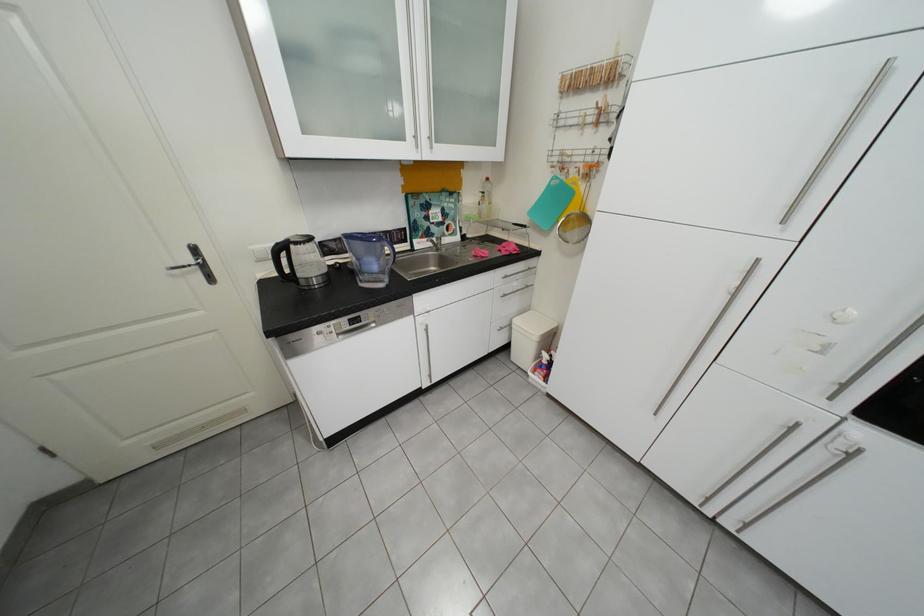
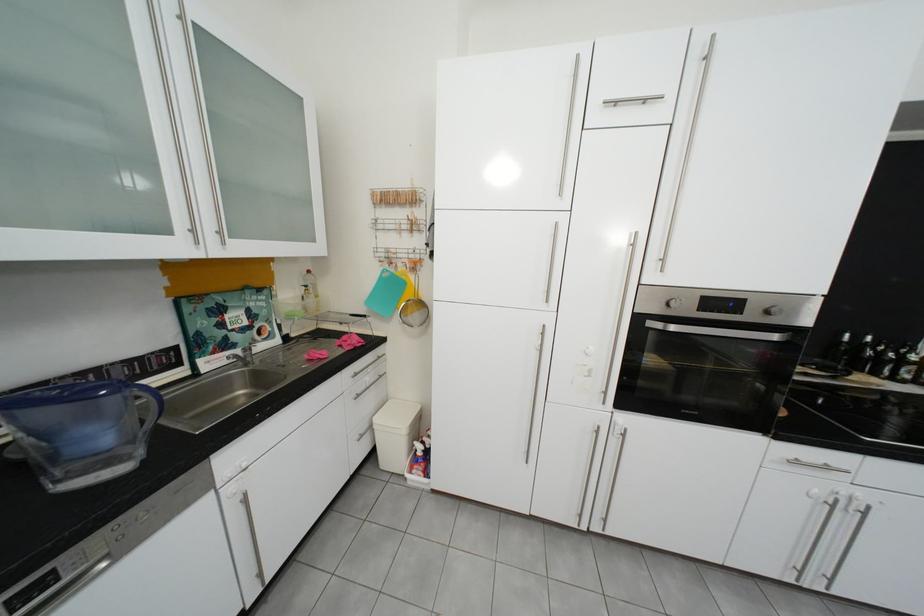
Locate, in the second image, the point that corresponds to (x=372, y=283) in the first image.

(70, 483)